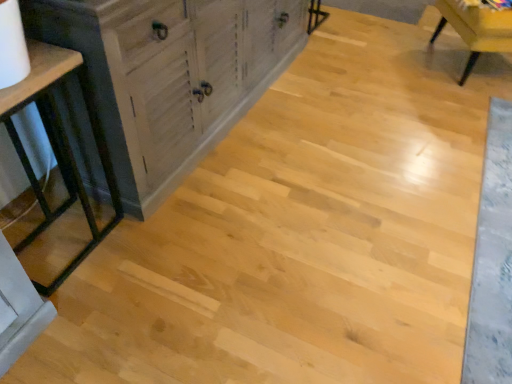
What do you see at coordinates (476, 30) in the screenshot? I see `wooden chair at upper right` at bounding box center [476, 30].

Measure the distance between distressed wood cabinet at left and camera.

distressed wood cabinet at left and camera are 1.13 meters apart from each other.

The height and width of the screenshot is (384, 512). Find the location of `matte black table at left`. matte black table at left is located at coordinates tap(59, 145).

Would you say matte black table at left is part of distressed wood cabinet at left's contents?

That's incorrect, matte black table at left is not inside distressed wood cabinet at left.

Considering the relative sizes of distressed wood cabinet at left and matte black table at left in the image provided, is distressed wood cabinet at left smaller than matte black table at left?

Actually, distressed wood cabinet at left might be larger than matte black table at left.

From the image's perspective, would you say distressed wood cabinet at left is positioned over matte black table at left?

Yes.

Is point (264, 61) closer to camera compared to point (115, 214)?

No, it is not.

Is wooden chair at upper right taller than matte black table at left?

No, wooden chair at upper right is not taller than matte black table at left.

Is wooden chair at upper right looking in the opposite direction of matte black table at left?

No.

How many degrees apart are the facing directions of wooden chair at upper right and matte black table at left?

wooden chair at upper right and matte black table at left are facing 62.1 degrees away from each other.

How many degrees apart are the facing directions of matte black table at left and wooden chair at upper right?

62.1 degrees separate the facing orientations of matte black table at left and wooden chair at upper right.

From a real-world perspective, is matte black table at left physically above wooden chair at upper right?

Yes, from a real-world perspective, matte black table at left is over wooden chair at upper right

Is matte black table at left thinner than wooden chair at upper right?

Yes.

Is matte black table at left far away from wooden chair at upper right?

Yes, matte black table at left and wooden chair at upper right are quite far apart.

Can you see wooden chair at upper right touching distressed wood cabinet at left?

wooden chair at upper right is not next to distressed wood cabinet at left, and they're not touching.

Which of these two, wooden chair at upper right or distressed wood cabinet at left, stands shorter?

wooden chair at upper right is shorter.

Find the location of a particular element. The width and height of the screenshot is (512, 384). chair to the right of distressed wood cabinet at left is located at coordinates (476, 30).

Based on their sizes in the image, would you say matte black table at left is bigger or smaller than distressed wood cabinet at left?

Clearly, matte black table at left is smaller in size than distressed wood cabinet at left.

Is matte black table at left positioned beyond the bounds of distressed wood cabinet at left?

Absolutely, matte black table at left is external to distressed wood cabinet at left.

From the image's perspective, does matte black table at left appear higher than distressed wood cabinet at left?

Incorrect, from the image's perspective, matte black table at left is lower than distressed wood cabinet at left.

Considering the sizes of objects distressed wood cabinet at left and wooden chair at upper right in the image provided, who is smaller, distressed wood cabinet at left or wooden chair at upper right?

With smaller size is wooden chair at upper right.

Is distressed wood cabinet at left positioned beyond the bounds of wooden chair at upper right?

That's correct, distressed wood cabinet at left is outside of wooden chair at upper right.

Is distressed wood cabinet at left oriented away from wooden chair at upper right?

No.

Is distressed wood cabinet at left thinner than wooden chair at upper right?

Correct, the width of distressed wood cabinet at left is less than that of wooden chair at upper right.

At what (x,y) coordinates should I click in order to perform the action: click on table on the left side of distressed wood cabinet at left. Please return your answer as a coordinate pair (x, y). Image resolution: width=512 pixels, height=384 pixels. Looking at the image, I should click on (59, 145).

You are a GUI agent. You are given a task and a screenshot of the screen. Output one action in this format:
    pyautogui.click(x=<x>, y=<y>)
    Task: Click on the chair located underneath the matte black table at left (from a real-world perspective)
    This screenshot has height=384, width=512.
    Given the screenshot: What is the action you would take?
    pyautogui.click(x=476, y=30)

From the image, which object appears to be farther from matte black table at left, wooden chair at upper right or distressed wood cabinet at left?

The object further to matte black table at left is wooden chair at upper right.

From the image, which object appears to be nearer to distressed wood cabinet at left, wooden chair at upper right or matte black table at left?

matte black table at left lies closer to distressed wood cabinet at left than the other object.

When comparing their distances from wooden chair at upper right, does distressed wood cabinet at left or matte black table at left seem closer?

The object closer to wooden chair at upper right is distressed wood cabinet at left.

When comparing their distances from distressed wood cabinet at left, does matte black table at left or wooden chair at upper right seem closer?

Based on the image, matte black table at left appears to be nearer to distressed wood cabinet at left.

From the image, which object appears to be farther from wooden chair at upper right, matte black table at left or distressed wood cabinet at left?

matte black table at left is further to wooden chair at upper right.

Consider the image. Which object lies further to the anchor point matte black table at left, distressed wood cabinet at left or wooden chair at upper right?

A: wooden chair at upper right is positioned further to the anchor matte black table at left.

Locate an element on the screen. This screenshot has height=384, width=512. cabinetry between matte black table at left and wooden chair at upper right from left to right is located at coordinates 170,75.